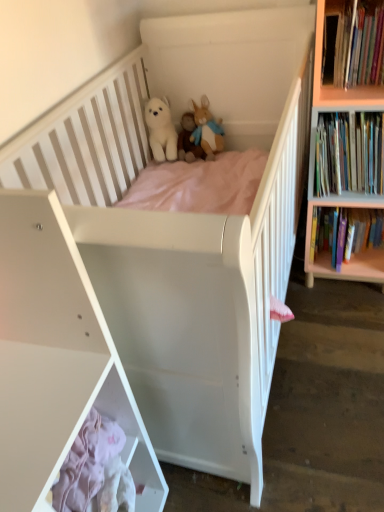
The width and height of the screenshot is (384, 512). I want to click on free space in front of light wood bookcase at right, so click(x=339, y=324).